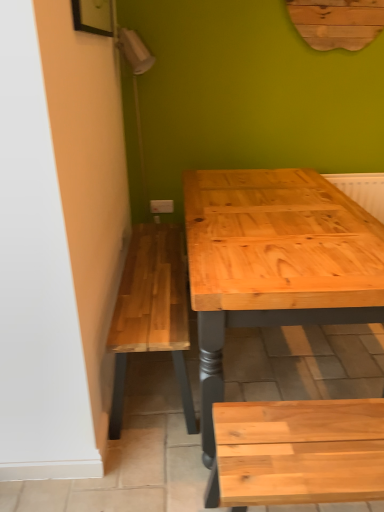
Describe the element at coordinates (297, 452) in the screenshot. This screenshot has width=384, height=512. I see `natural wood bench at lower right` at that location.

Identify the location of natural wood bench at lower right. This screenshot has width=384, height=512. (297, 452).

At what (x,y) coordinates should I click in order to perform the action: click on white plastic electric outlet at center. Please return your answer as a coordinate pair (x, y). The image size is (384, 512). Looking at the image, I should click on (161, 206).

Measure the distance between point (161, 212) and camera.

Point (161, 212) is 2.75 meters away from camera.

The image size is (384, 512). What do you see at coordinates (161, 206) in the screenshot?
I see `white plastic electric outlet at center` at bounding box center [161, 206].

This screenshot has width=384, height=512. Find the location of `natural wood bench at lower right`. natural wood bench at lower right is located at coordinates (297, 452).

Which is more to the left, natural wood bench at lower right or white plastic electric outlet at center?

white plastic electric outlet at center is more to the left.

Considering the positions of objects natural wood bench at lower right and white plastic electric outlet at center in the image provided, who is in front, natural wood bench at lower right or white plastic electric outlet at center?

natural wood bench at lower right is in front.

Is point (268, 497) closer or farther from the camera than point (154, 205)?

Point (268, 497) is positioned closer to the camera compared to point (154, 205).

In the scene shown: From the image's perspective, between natural wood bench at lower right and white plastic electric outlet at center, who is located below?

From the image's view, natural wood bench at lower right is below.

From a real-world perspective, relative to white plastic electric outlet at center, is natural wood bench at lower right vertically above or below?

From a real-world perspective, natural wood bench at lower right is physically below white plastic electric outlet at center.

Looking at this image, considering the sizes of natural wood bench at lower right and white plastic electric outlet at center in the image, is natural wood bench at lower right wider or thinner than white plastic electric outlet at center?

Considering their sizes, natural wood bench at lower right looks broader than white plastic electric outlet at center.

In terms of height, does natural wood bench at lower right look taller or shorter compared to white plastic electric outlet at center?

In the image, natural wood bench at lower right appears to be taller than white plastic electric outlet at center.

In the scene shown: Between natural wood bench at lower right and white plastic electric outlet at center, which one has smaller size?

With smaller size is white plastic electric outlet at center.

Is natural wood bench at lower right not within white plastic electric outlet at center?

Yes, natural wood bench at lower right is outside of white plastic electric outlet at center.

Looking at this image, would you consider natural wood bench at lower right to be distant from white plastic electric outlet at center?

Yes, natural wood bench at lower right is far from white plastic electric outlet at center.

Is natural wood bench at lower right facing towards white plastic electric outlet at center?

No.

Can you tell me how much natural wood bench at lower right and white plastic electric outlet at center differ in facing direction?

2.44 degrees.

Find the location of a particular element. This screenshot has height=512, width=384. church bench below the white plastic electric outlet at center (from a real-world perspective) is located at coordinates (297, 452).

Between white plastic electric outlet at center and natural wood bench at lower right, which one appears on the right side from the viewer's perspective?

Positioned to the right is natural wood bench at lower right.

Which object is closer to the camera, white plastic electric outlet at center or natural wood bench at lower right?

natural wood bench at lower right.

Which point is more forward, (164, 206) or (347, 453)?

The point (347, 453) is in front.

From the image's perspective, is white plastic electric outlet at center beneath natural wood bench at lower right?

No, from the image's perspective, white plastic electric outlet at center is not beneath natural wood bench at lower right.

From a real-world perspective, who is located lower, white plastic electric outlet at center or natural wood bench at lower right?

From a 3D spatial view, natural wood bench at lower right is below.

Considering the sizes of objects white plastic electric outlet at center and natural wood bench at lower right in the image provided, who is wider, white plastic electric outlet at center or natural wood bench at lower right?

Wider between the two is natural wood bench at lower right.

Does white plastic electric outlet at center have a lesser height compared to natural wood bench at lower right?

Yes.

Which of these two, white plastic electric outlet at center or natural wood bench at lower right, is bigger?

With larger size is natural wood bench at lower right.

Is white plastic electric outlet at center surrounding natural wood bench at lower right?

Actually, natural wood bench at lower right is outside white plastic electric outlet at center.

In the scene shown: Is white plastic electric outlet at center next to natural wood bench at lower right and touching it?

There is a gap between white plastic electric outlet at center and natural wood bench at lower right.

Is white plastic electric outlet at center oriented away from natural wood bench at lower right?

No, natural wood bench at lower right is not at the back of white plastic electric outlet at center.

Can you tell me how much white plastic electric outlet at center and natural wood bench at lower right differ in facing direction?

There is a 2.44-degree angle between the facing directions of white plastic electric outlet at center and natural wood bench at lower right.

Looking at this image, how distant is white plastic electric outlet at center from natural wood bench at lower right?

white plastic electric outlet at center is 1.89 meters from natural wood bench at lower right.

The image size is (384, 512). I want to click on electric outlet on the left of the natural wood bench at lower right, so click(161, 206).

Locate an element on the screen. Image resolution: width=384 pixels, height=512 pixels. electric outlet positioned vertically above the natural wood bench at lower right (from a real-world perspective) is located at coordinates (161, 206).

I want to click on church bench below the white plastic electric outlet at center (from a real-world perspective), so tap(297, 452).